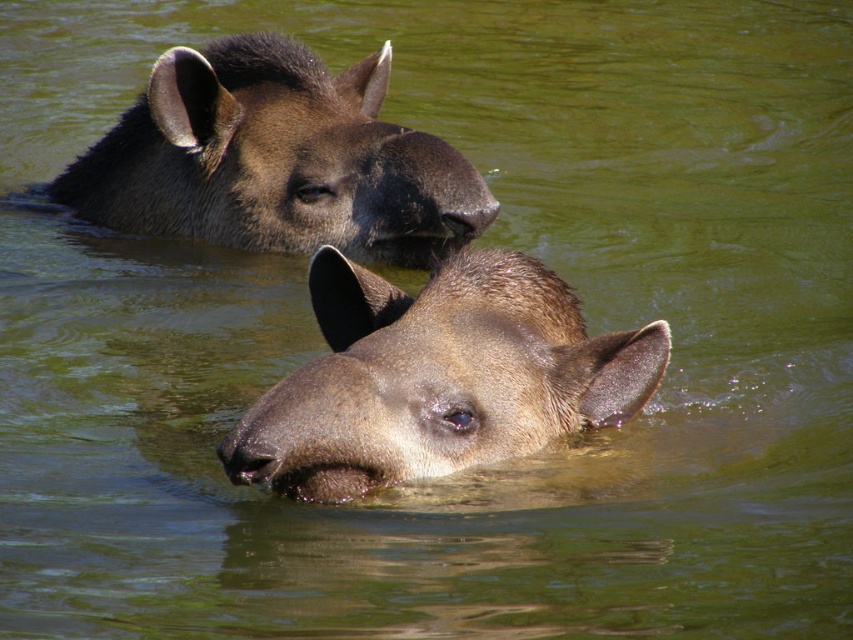
Question: Which point appears closest to the camera in this image?

Choices:
 (A) (323, 129)
 (B) (401, 406)

Answer: (B)

Question: Which object is farther from the camera taking this photo?

Choices:
 (A) brown matte tapir head at center
 (B) brown matte tapir at upper center

Answer: (B)

Question: Among these objects, which one is farthest from the camera?

Choices:
 (A) brown matte tapir head at center
 (B) brown matte tapir at upper center

Answer: (B)

Question: Is brown matte tapir head at center behind brown matte tapir at upper center?

Choices:
 (A) no
 (B) yes

Answer: (A)

Question: From the image, what is the correct spatial relationship of brown matte tapir head at center in relation to brown matte tapir at upper center?

Choices:
 (A) above
 (B) below

Answer: (B)

Question: Does brown matte tapir head at center appear over brown matte tapir at upper center?

Choices:
 (A) no
 (B) yes

Answer: (A)